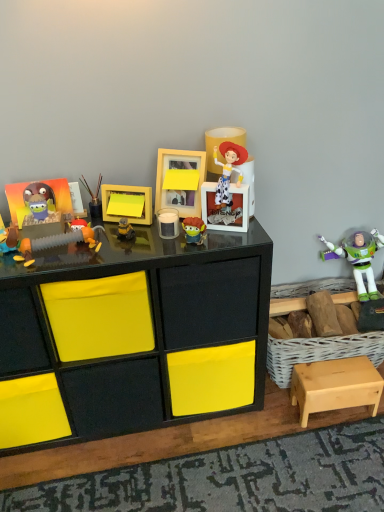
Locate an element on the screen. Image resolution: width=384 pixels, height=512 pixels. free location to the right of matte orange toy at center-left, which ranks as the 5th toy in right-to-left order is located at coordinates (142, 250).